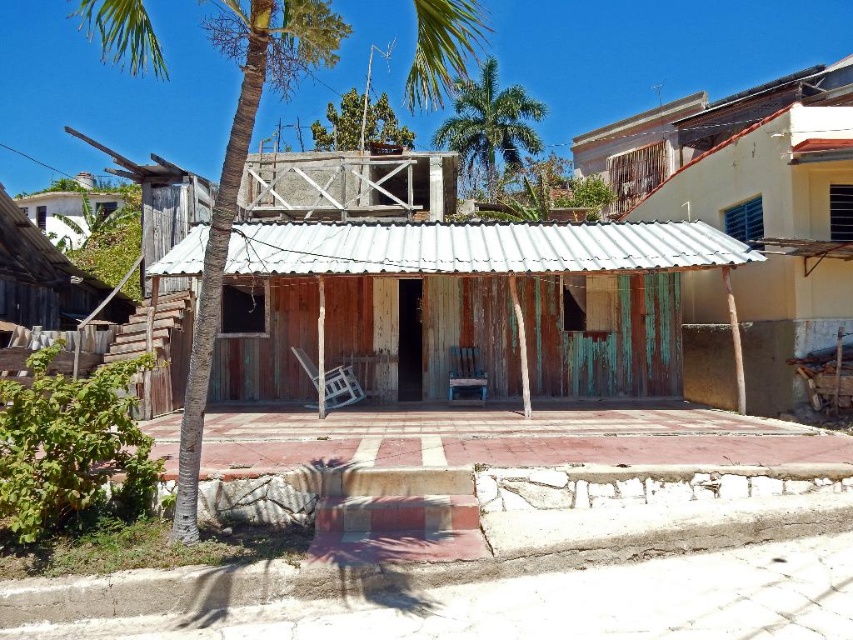
Question: Which point is farther to the camera?

Choices:
 (A) (178, 515)
 (B) (518, 118)

Answer: (B)

Question: Estimate the real-world distances between objects in this image. Which object is farther from the green leafy palm tree at upper center?

Choices:
 (A) green weathered wood hut at center
 (B) green leafy palm tree at center

Answer: (A)

Question: Is green weathered wood hut at center positioned behind green leafy palm tree at center?

Choices:
 (A) no
 (B) yes

Answer: (B)

Question: Among these points, which one is nearest to the camera?

Choices:
 (A) (697, 237)
 (B) (193, 378)

Answer: (B)

Question: From the image, what is the correct spatial relationship of green leafy palm tree at center in relation to green leafy palm tree at upper center?

Choices:
 (A) right
 (B) left

Answer: (B)

Question: In this image, where is green weathered wood hut at center located relative to green leafy palm tree at center?

Choices:
 (A) right
 (B) left

Answer: (A)